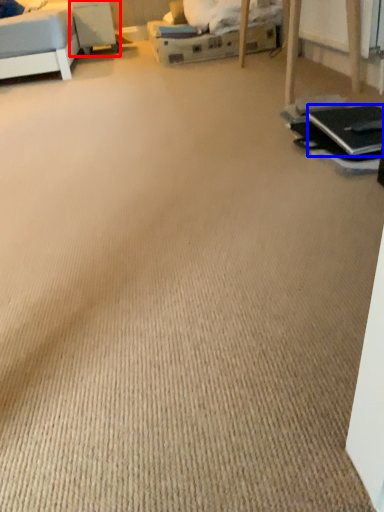
Question: Which object appears farthest to the camera in this image, table (highlighted by a red box) or laptop (highlighted by a blue box)?

Choices:
 (A) table
 (B) laptop

Answer: (A)